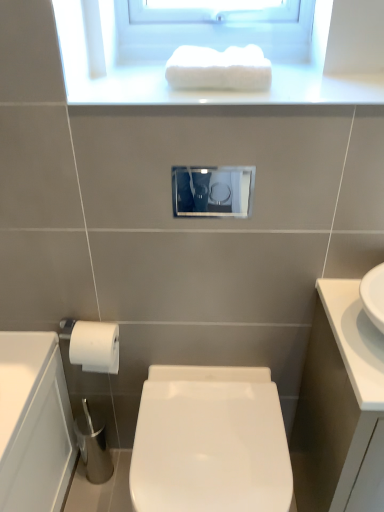
I want to click on vacant area on top of white glossy toilet at center (from a real-world perspective), so click(205, 430).